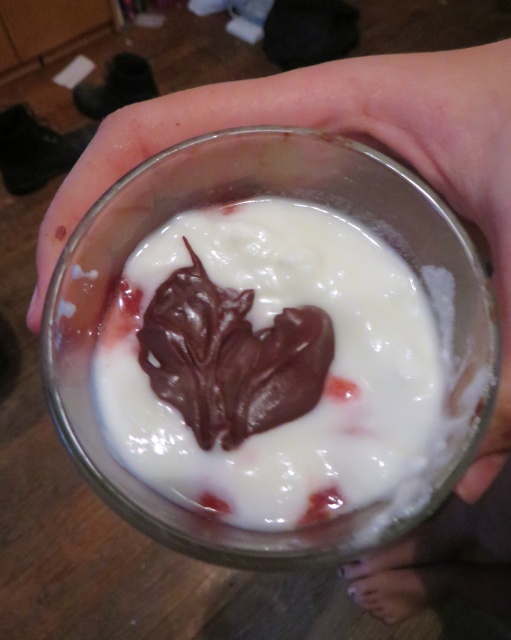
Between smooth white yogurt at center and transparent glass at center, which one is positioned lower?

Positioned lower is smooth white yogurt at center.

Identify the location of smooth white yogurt at center. This screenshot has width=511, height=640. (268, 364).

Find the location of a particular element. smooth white yogurt at center is located at coordinates (268, 364).